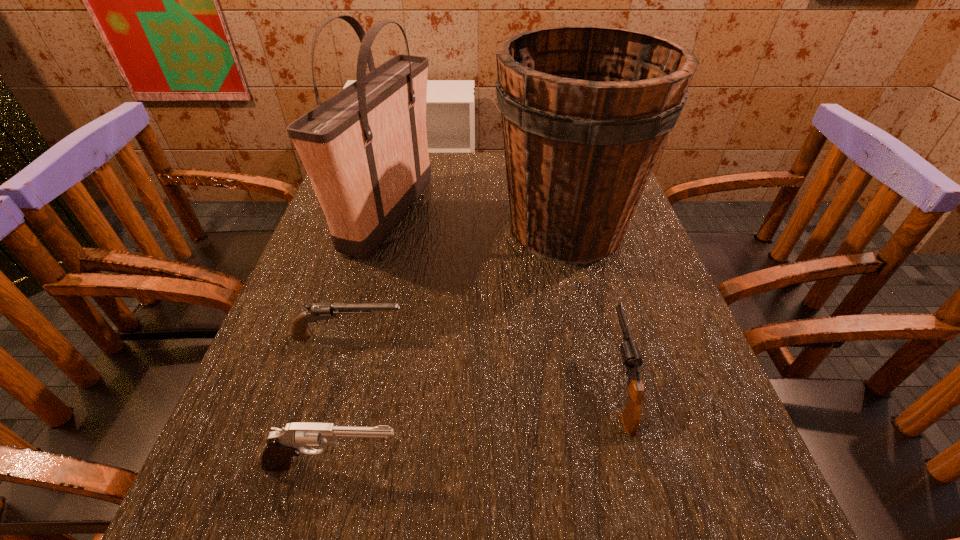
Where is `free point between the farthest gun and the second farthest gun`? free point between the farthest gun and the second farthest gun is located at coordinates (484, 361).

Find the location of `free spot between the third farthest object and the shopping bag`. free spot between the third farthest object and the shopping bag is located at coordinates (369, 276).

What are the coordinates of `vacant region between the second nearest object and the nearest gun` in the screenshot? It's located at (476, 426).

Identify the location of free space between the rightmost gun and the shopping bag. The image size is (960, 540). (504, 301).

Where is `blank region between the shopping bag and the bucket`? The width and height of the screenshot is (960, 540). blank region between the shopping bag and the bucket is located at coordinates (478, 222).

Locate an element on the screen. object that is the second closest to the shortest gun is located at coordinates (282, 444).

This screenshot has height=540, width=960. I want to click on object identified as the closest to the shortest object, so click(x=365, y=149).

Locate an element on the screen. The height and width of the screenshot is (540, 960). gun that is the nearest to the shopping bag is located at coordinates (299, 330).

Identify the location of gun that is the third closest one to the bucket. (282, 444).

The height and width of the screenshot is (540, 960). I want to click on vacant space that satisfies the following two spatial constraints: 1. aiming along the barrel of the farthest gun; 2. along the barrel of the fourth farthest object, so click(x=334, y=386).